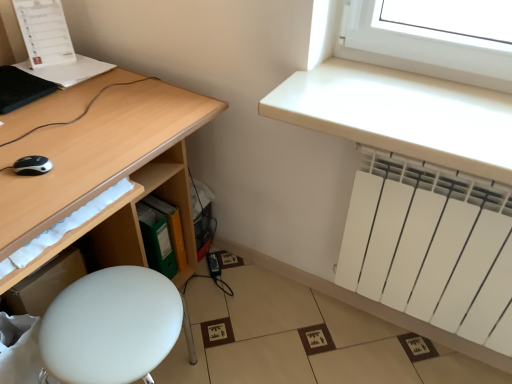
Question: Is white matte stool at lower left inside the boundaries of white matte radiator at upper right, or outside?

Choices:
 (A) outside
 (B) inside

Answer: (A)

Question: Considering the positions of white matte stool at lower left and white matte radiator at upper right in the image, is white matte stool at lower left wider or thinner than white matte radiator at upper right?

Choices:
 (A) thin
 (B) wide

Answer: (B)

Question: Considering the real-world distances, which object is farthest from the white matte radiator at upper right?

Choices:
 (A) black plastic mouse at lower left
 (B) green plastic file at lower center
 (C) white matte stool at lower left
 (D) matte wood desk at left
 (E) white paper at upper left

Answer: (E)

Question: Which object is the farthest from the white matte radiator at lower right?

Choices:
 (A) white matte stool at lower left
 (B) white matte radiator at upper right
 (C) matte wood desk at left
 (D) black plastic mouse at lower left
 (E) green plastic file at lower center

Answer: (D)